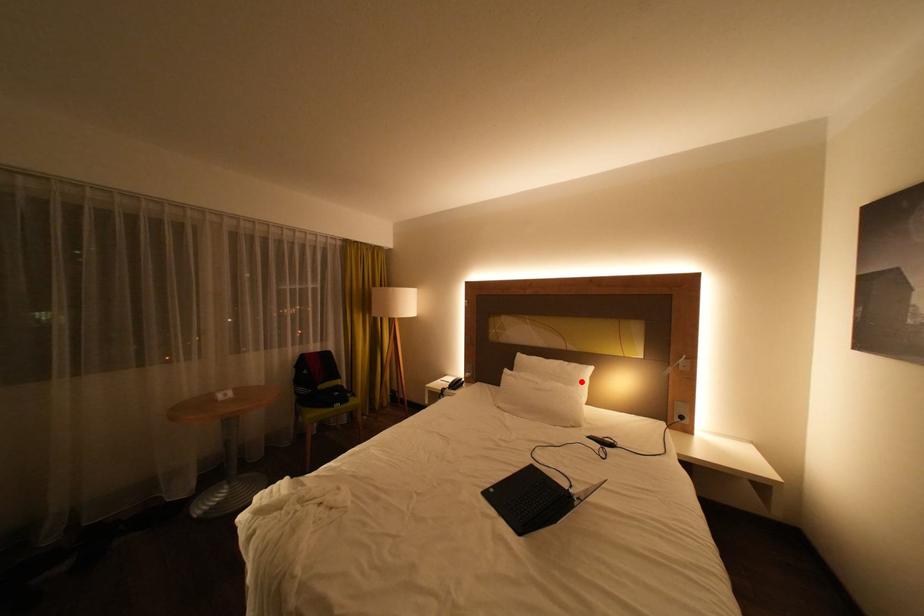
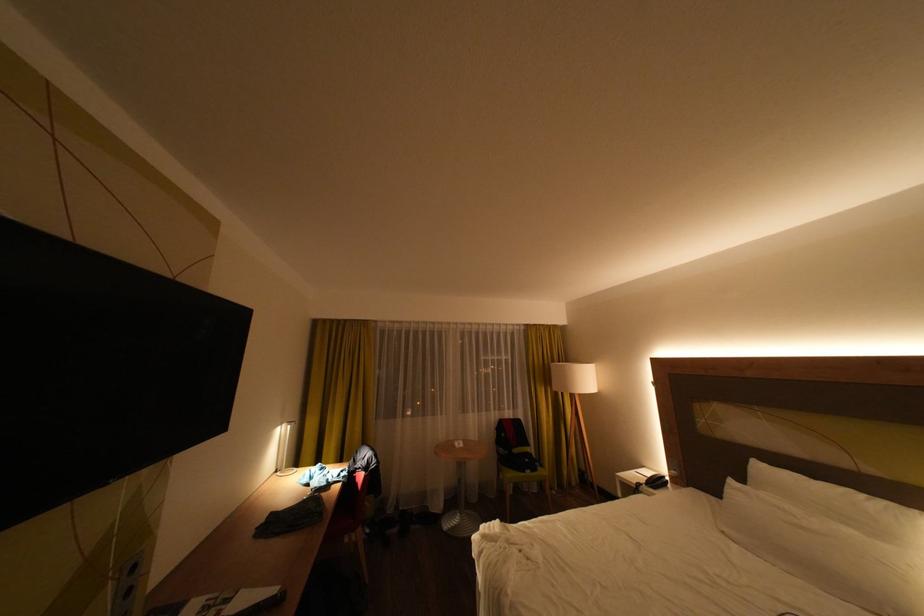
The point at the highlighted location is marked in the first image. Where is the corresponding point in the second image?

(893, 533)